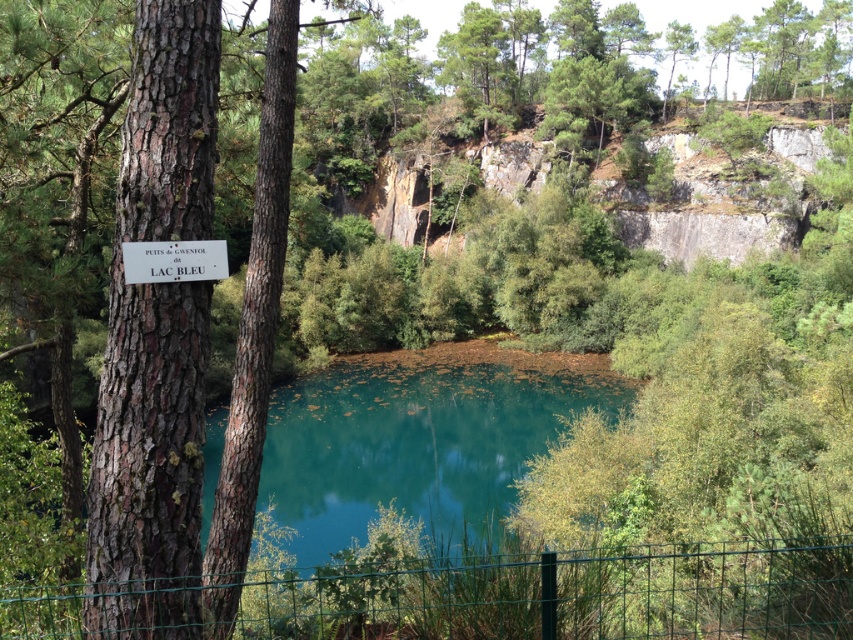
You are a hiker who wants to read the white wooden sign at upper left. Which direction should you look relative to the brown rough bark tree at left to find it?

The white wooden sign at upper left is located above the brown rough bark tree at left, so you should look upward from the brown rough bark tree at left to find it.

You are a hiker who wants to take a photo of the white wooden sign at upper left and the teal glossy water at center. Which object should you focus on first if you want to capture both in one frame without moving the camera?

The teal glossy water at center is bigger than the white wooden sign at upper left, so you should focus on the teal glossy water at center first to ensure it fills the frame adequately before adjusting for the smaller sign.